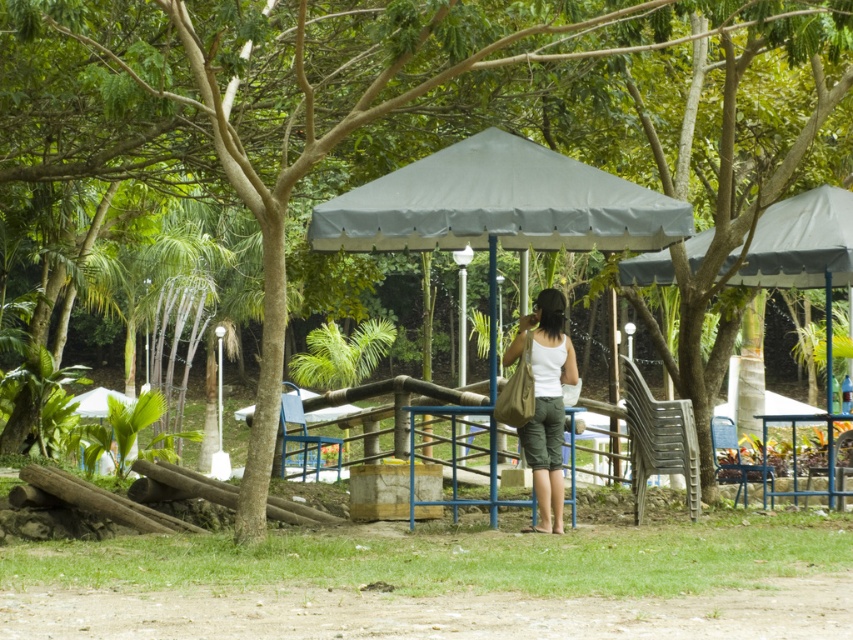
Who is taller, gray fabric canopy at upper center or white matte tank top at center?

white matte tank top at center

Between point (659, 257) and point (556, 376), which one is positioned behind?

The point (659, 257) is behind.

Is point (772, 262) positioned behind point (548, 515)?

That is True.

The image size is (853, 640). Identify the location of gray fabric canopy at upper center. (801, 243).

Between point (473, 157) and point (526, 337), which one is positioned in front?

Point (526, 337)

Find the location of a particular element. The image size is (853, 640). gray fabric canopy at center is located at coordinates (498, 204).

Measure the distance between point (x=416, y=179) and camera.

42.60 feet

The height and width of the screenshot is (640, 853). I want to click on gray fabric canopy at center, so click(x=498, y=204).

Is point (469, 209) closer to viewer compared to point (734, 280)?

Yes, it is.

Where is `gray fabric canopy at center`? The height and width of the screenshot is (640, 853). gray fabric canopy at center is located at coordinates (498, 204).